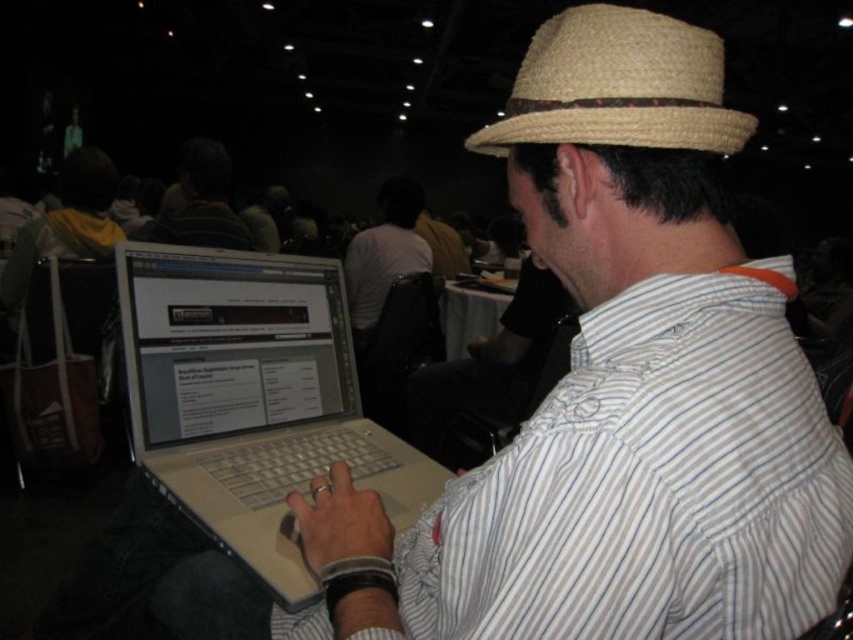
Which is above, silver metallic laptop at center or straw hat at upper center?

straw hat at upper center

Which is below, silver metallic laptop at center or straw hat at upper center?

silver metallic laptop at center is lower down.

Does point (277, 589) come behind point (523, 134)?

Yes.

Image resolution: width=853 pixels, height=640 pixels. Find the location of `silver metallic laptop at center`. silver metallic laptop at center is located at coordinates (252, 397).

Does straw hat at upper center come behind dark brown leather jacket at upper center?

No.

Does straw hat at upper center appear on the left side of dark brown leather jacket at upper center?

Incorrect, straw hat at upper center is not on the left side of dark brown leather jacket at upper center.

Is point (621, 138) positioned after point (225, 150)?

No, (621, 138) is in front of (225, 150).

Identify the location of straw hat at upper center. (618, 86).

Does point (358, 476) come in front of point (154, 241)?

Yes.

Can you confirm if silver metallic laptop at center is taller than dark brown leather jacket at upper center?

Incorrect, silver metallic laptop at center's height is not larger of dark brown leather jacket at upper center's.

Which is in front, point (222, 314) or point (186, 228)?

Point (222, 314)

Image resolution: width=853 pixels, height=640 pixels. What are the coordinates of `silver metallic laptop at center` in the screenshot? It's located at (252, 397).